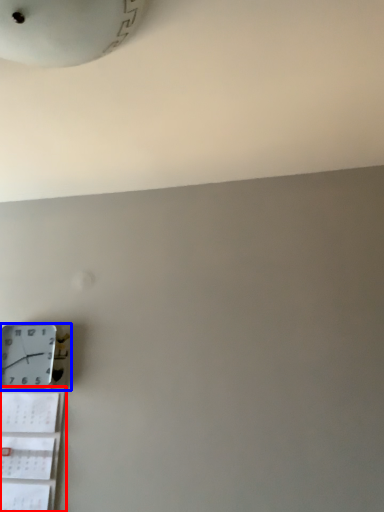
Question: Among these objects, which one is farthest to the camera, shelf (highlighted by a red box) or wall clock (highlighted by a blue box)?

Choices:
 (A) shelf
 (B) wall clock

Answer: (B)